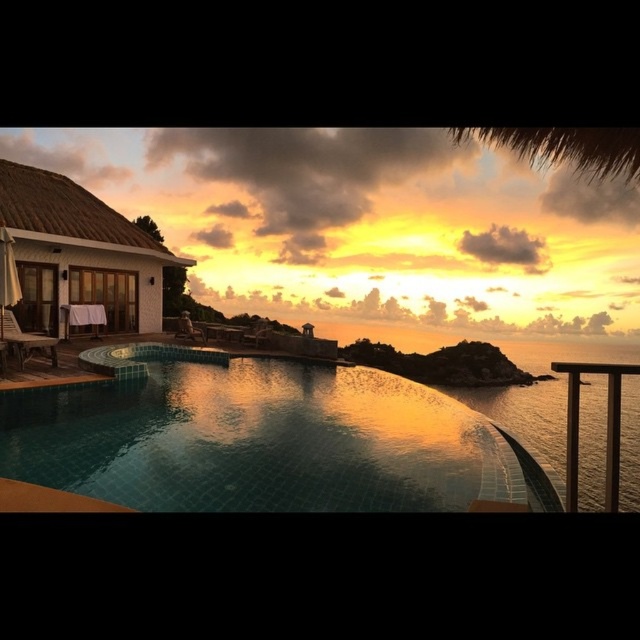
Who is more distant from viewer, (152, 264) or (17, 346)?

The point (152, 264) is behind.

Between point (104, 221) and point (10, 340), which one is positioned in front?

Point (10, 340) is in front.

Is point (99, 252) positioned behind point (35, 342)?

Yes.

The image size is (640, 640). Identify the location of white textured hut at left. (77, 256).

Does tile mosaic pool at center have a lesser height compared to matte wood chair at lower left?

No, tile mosaic pool at center is not shorter than matte wood chair at lower left.

Who is positioned more to the left, tile mosaic pool at center or matte wood chair at lower left?

From the viewer's perspective, matte wood chair at lower left appears more on the left side.

Identify the location of tile mosaic pool at center. The image size is (640, 640). click(x=266, y=440).

Does tile mosaic pool at center lie behind white textured hut at left?

No, tile mosaic pool at center is closer to the viewer.

Where is `tile mosaic pool at center`? tile mosaic pool at center is located at coordinates (266, 440).